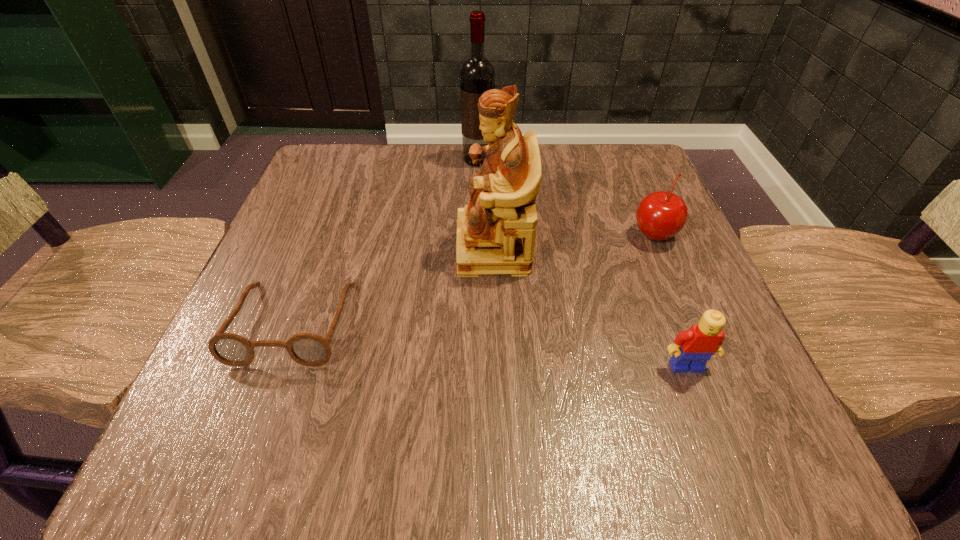
Where is `blank space at the right edge of the desktop`? The image size is (960, 540). blank space at the right edge of the desktop is located at coordinates (642, 326).

The image size is (960, 540). In the image, there is a desktop. Find the location of `free region at the far left corner`. free region at the far left corner is located at coordinates (330, 153).

In order to click on vacant space at the near right corner in this screenshot , I will do `click(797, 456)`.

The image size is (960, 540). In order to click on vacant space in between the cherry and the shortest object in this screenshot , I will do `click(473, 278)`.

The height and width of the screenshot is (540, 960). Identify the location of free space between the farthest object and the cherry. (565, 197).

You are a GUI agent. You are given a task and a screenshot of the screen. Output one action in this format:
    pyautogui.click(x=<x>, y=<y>)
    Task: Click on the vacant area that lies between the figurine and the Lego
    This screenshot has height=540, width=960.
    Given the screenshot: What is the action you would take?
    pyautogui.click(x=589, y=307)

Where is `empty space that is in between the Lego and the spectacles`? Image resolution: width=960 pixels, height=540 pixels. empty space that is in between the Lego and the spectacles is located at coordinates (490, 345).

The height and width of the screenshot is (540, 960). In order to click on vacant space that is in between the farthest object and the cherry in this screenshot , I will do `click(565, 197)`.

Image resolution: width=960 pixels, height=540 pixels. In order to click on free space that is in between the wine bottle and the cherry in this screenshot , I will do `click(565, 197)`.

Identify the location of free space between the farthest object and the spectacles. Image resolution: width=960 pixels, height=540 pixels. (386, 241).